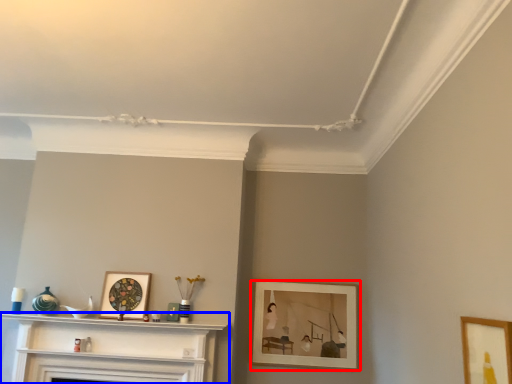
Question: Which object is closer to the camera taking this photo, picture frame (highlighted by a red box) or shelf (highlighted by a blue box)?

Choices:
 (A) picture frame
 (B) shelf

Answer: (B)